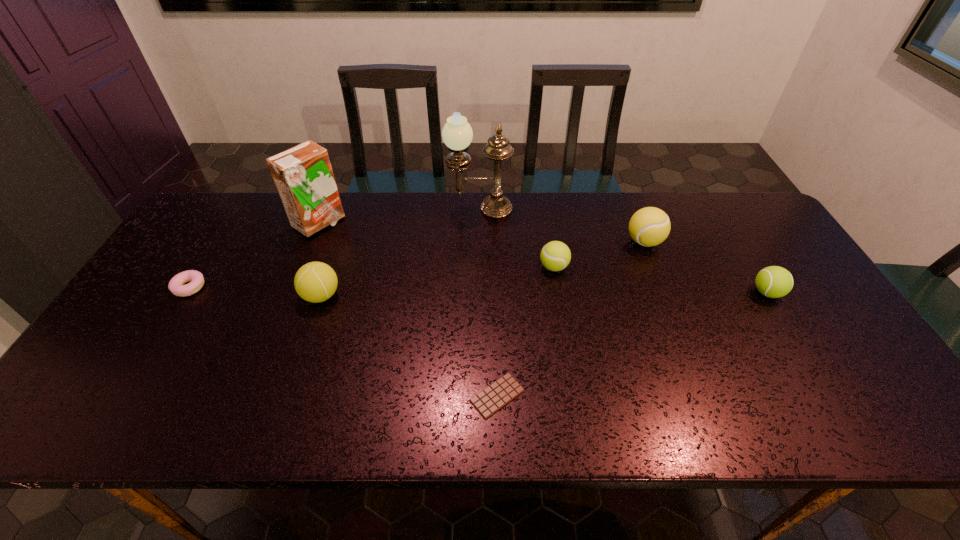
I want to click on vacant point that satisfies the following two spatial constraints: 1. on the straw side of the carton; 2. on the right side of the rightmost object, so click(291, 293).

This screenshot has width=960, height=540. What are the coordinates of `blank area in the image that satisfies the following two spatial constraints: 1. on the front side of the doughnut; 2. on the right side of the leftmost tennis ball` in the screenshot? It's located at tap(184, 296).

Locate an element on the screen. vacant space that satisfies the following two spatial constraints: 1. on the straw side of the second tallest object; 2. on the right side of the second object from right to left is located at coordinates (311, 242).

Find the location of `vacant space that satisfies the following two spatial constraints: 1. on the front side of the tallest object; 2. on the left side of the shortest object`. vacant space that satisfies the following two spatial constraints: 1. on the front side of the tallest object; 2. on the left side of the shortest object is located at coordinates (479, 396).